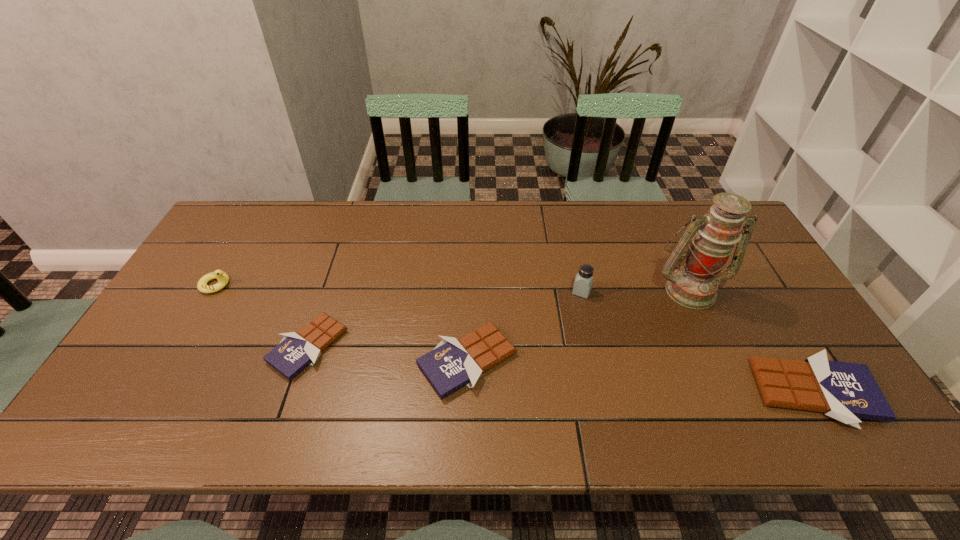
You are a GUI agent. You are given a task and a screenshot of the screen. Output one action in this format:
    pyautogui.click(x=<x>, y=<y>)
    Task: Click on the vacant space that satisfies the following two spatial constraints: 1. on the back side of the third object from left to right; 2. on the right side of the tallest object
    
    Given the screenshot: What is the action you would take?
    pyautogui.click(x=469, y=289)

This screenshot has width=960, height=540. What are the coordinates of `vacant space that satisfies the following two spatial constraints: 1. on the back side of the rightmost chocolate bar; 2. on the face of the leftmost object` in the screenshot? It's located at (750, 285).